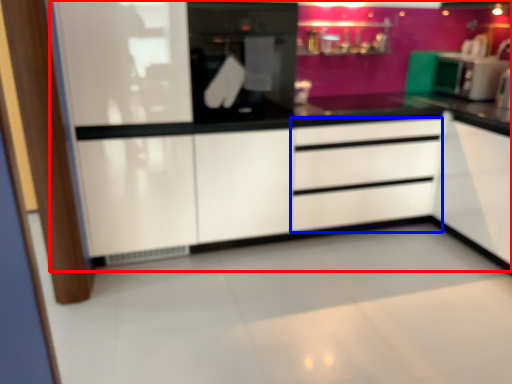
Question: Which of the following is the farthest to the observer, dresser (highlighted by a red box) or drawer (highlighted by a blue box)?

Choices:
 (A) dresser
 (B) drawer

Answer: (B)